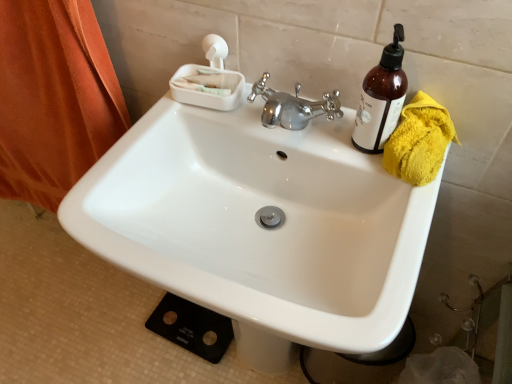
This screenshot has width=512, height=384. In order to click on free space in front of orange fabric at left in this screenshot , I will do `click(74, 314)`.